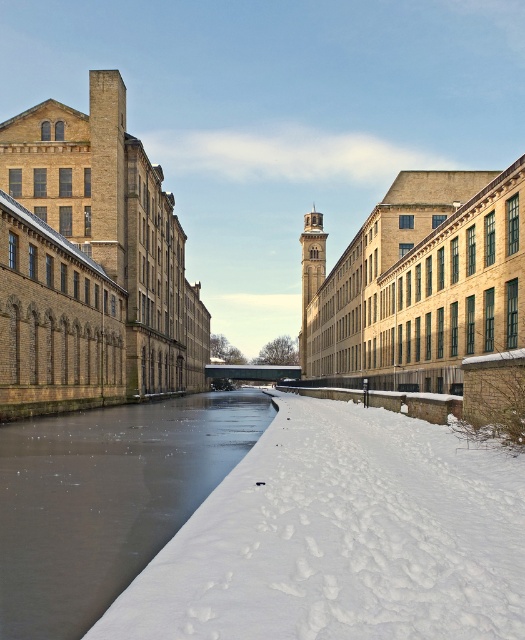
From the picture: Is white fluffy snow at lower right wider than frozen ice at center?

Incorrect, white fluffy snow at lower right's width does not surpass frozen ice at center's.

Does white fluffy snow at lower right appear on the right side of frozen ice at center?

Correct, you'll find white fluffy snow at lower right to the right of frozen ice at center.

Where is `white fluffy snow at lower right`? The height and width of the screenshot is (640, 525). white fluffy snow at lower right is located at coordinates (341, 538).